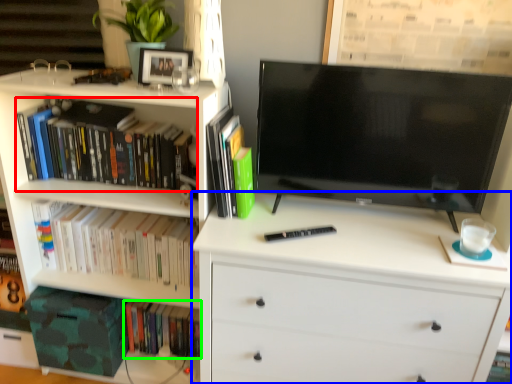
Question: Which is nearer to the book (highlighted by a red box)? chest of drawers (highlighted by a blue box) or book (highlighted by a green box).

Choices:
 (A) chest of drawers
 (B) book

Answer: (A)